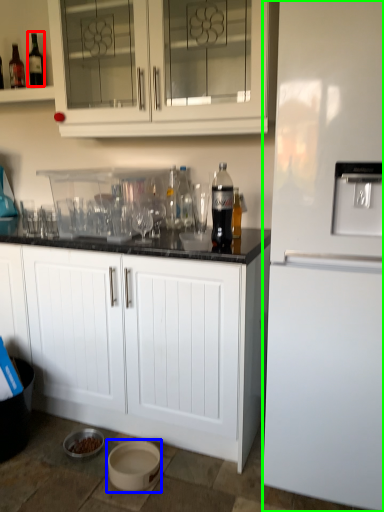
Question: Estimate the real-world distances between objects in this image. Which object is closer to drinking straw (highlighted by a red box), basin (highlighted by a blue box) or refrigerator (highlighted by a green box)?

Choices:
 (A) basin
 (B) refrigerator

Answer: (B)